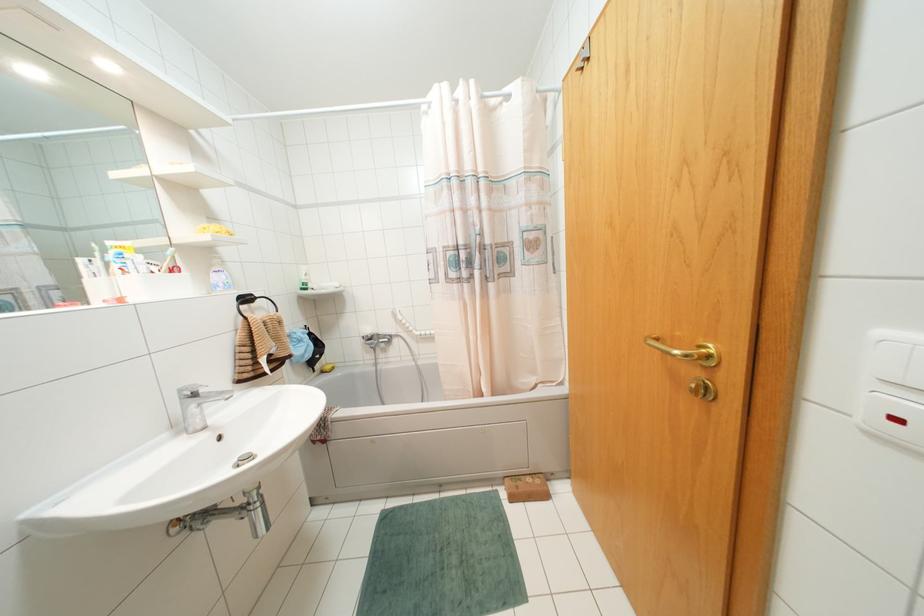
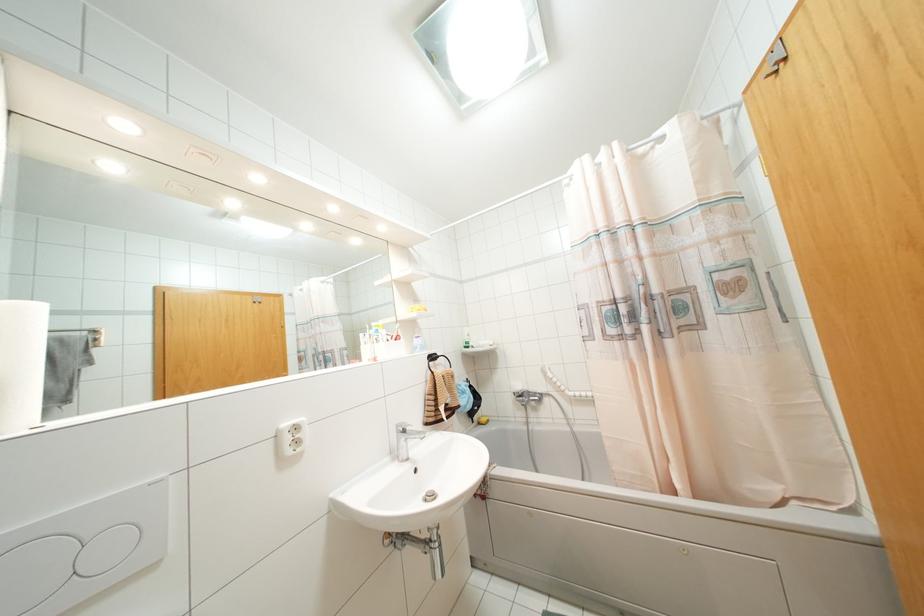
The point at (x=580, y=68) is marked in the first image. Where is the corresponding point in the second image?

(775, 71)